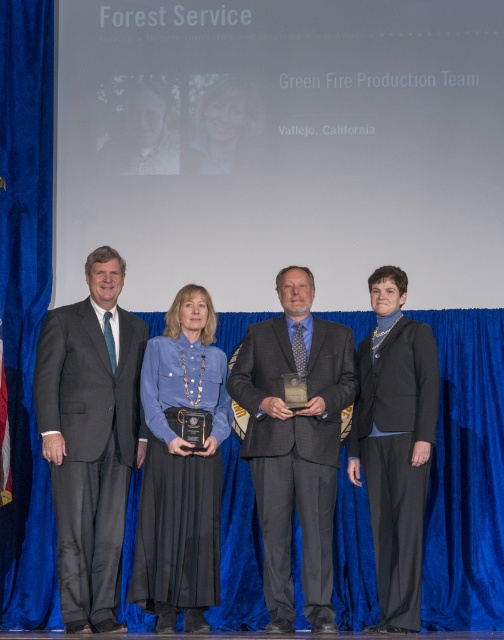
You are an event planner observing the stage setup for the Forest Service award ceremony. You notice two elements at the center of the stage area labeled as dark gray suit at center and matte black hair at center. Based on their positions, which one is taller?

The dark gray suit at center is taller than the matte black hair at center.

You are a photographer at the event and need to ensure that the two central figures are framed properly. The gray wool suit at center and the matte black hair at center are both in your viewfinder. Which object occupies more horizontal space in the frame?

The gray wool suit at center is wider than matte black hair at center, so it occupies more horizontal space in the frame.